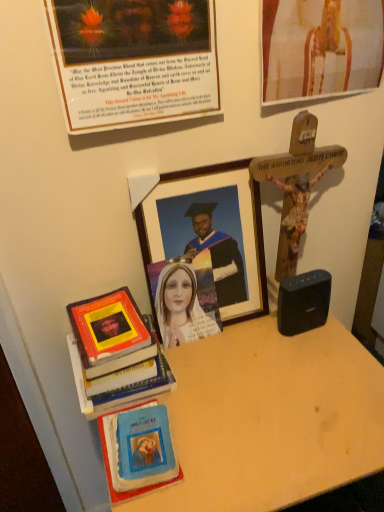
What are the coordinates of `free space between blue matte book at center, positioned as the second book in top-to-bottom order, and black plastic speaker at right` in the screenshot? It's located at (233, 391).